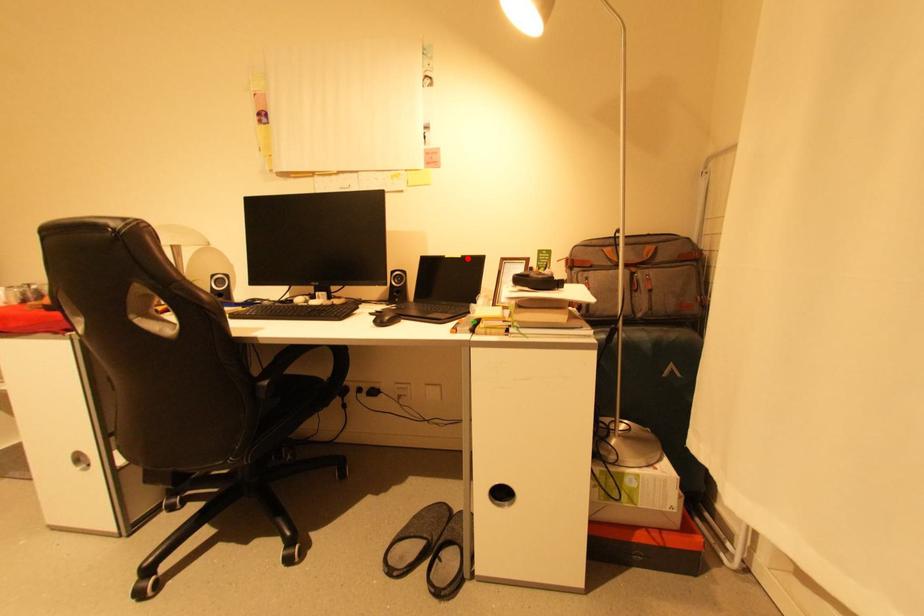
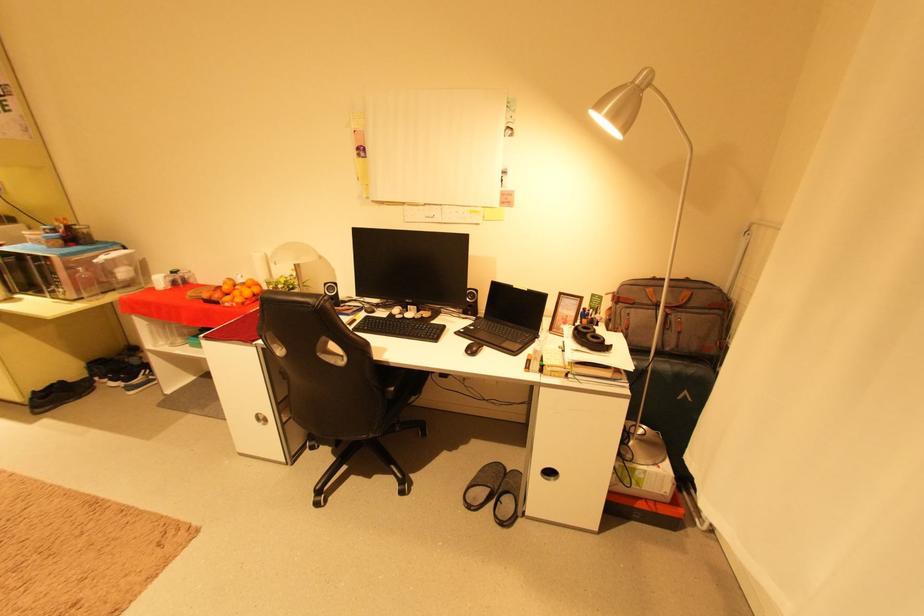
Question: I am providing you with two images of the same scene from different viewpoints. A red point is marked on the first image. Can you still see the location of the red point in image 2?

Choices:
 (A) Yes
 (B) No

Answer: (A)